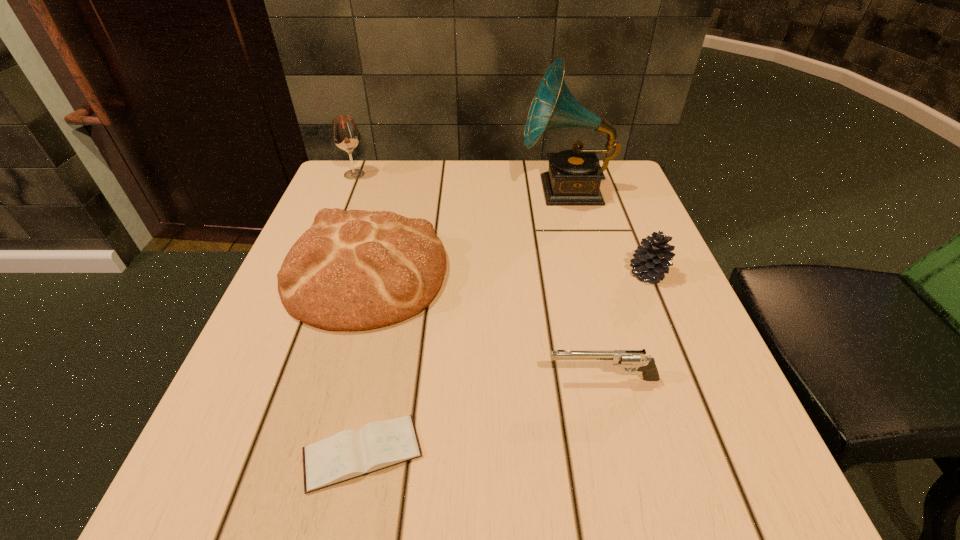
This screenshot has height=540, width=960. I want to click on vacant point located between the phonograph_record and the wineglass, so click(x=460, y=183).

Locate an element on the screen. free space between the fifth shortest object and the tallest object is located at coordinates (460, 183).

Locate which object ranks fifth in proximity to the tallest object. Please provide its 2D coordinates. Your answer should be formatted as a tuple, i.e. [(x, y)], where the tuple contains the x and y coordinates of a point satisfying the conditions above.

[(349, 454)]

At what (x,y) coordinates should I click in order to perform the action: click on the closest object to the fifth farthest object. Please return your answer as a coordinate pair (x, y). The height and width of the screenshot is (540, 960). Looking at the image, I should click on (353, 270).

Where is `free space that satisfies the following two spatial constraints: 1. on the front side of the third shortest object; 2. on the front-facing side of the second shortest object`? free space that satisfies the following two spatial constraints: 1. on the front side of the third shortest object; 2. on the front-facing side of the second shortest object is located at coordinates (690, 379).

Identify the location of free location that satisfies the following two spatial constraints: 1. on the front side of the third shortest object; 2. on the front-facing side of the second shortest object. (690, 379).